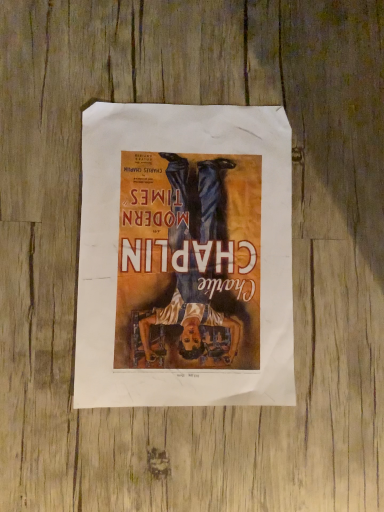
Where is `blank space situated above matte paper poster at center (from a real-world perspective)`? blank space situated above matte paper poster at center (from a real-world perspective) is located at coordinates (185, 256).